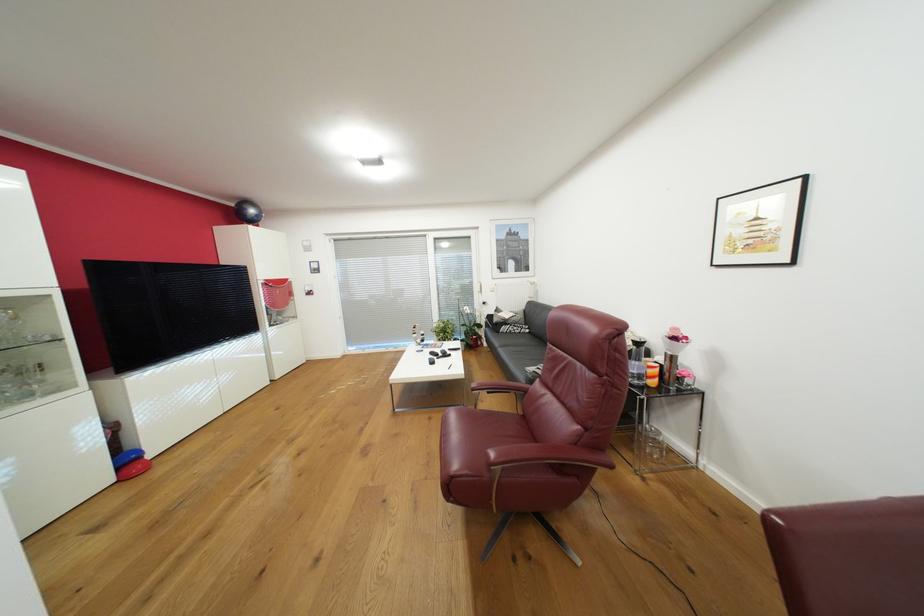
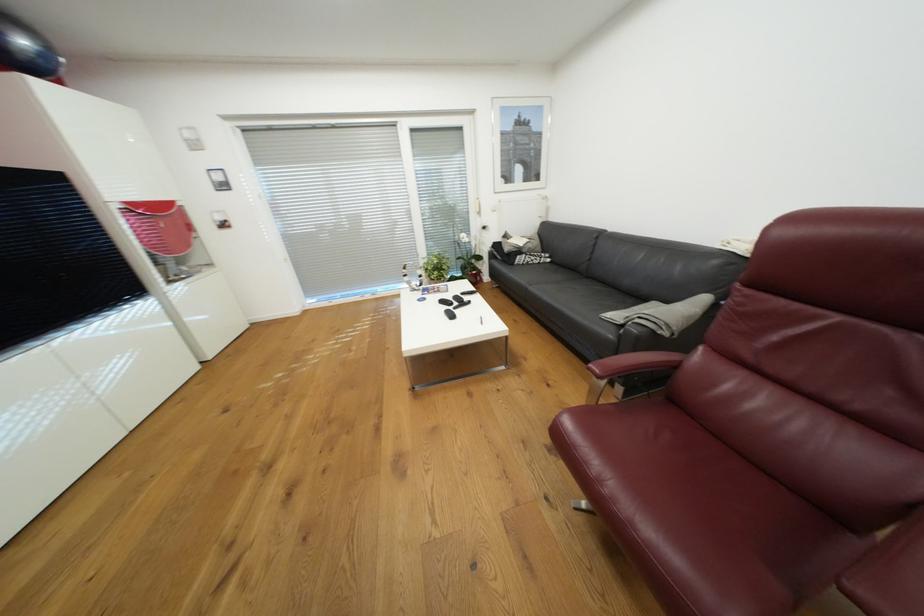
In the second image, find the point that corresponds to [314,249] in the first image.

(201, 145)